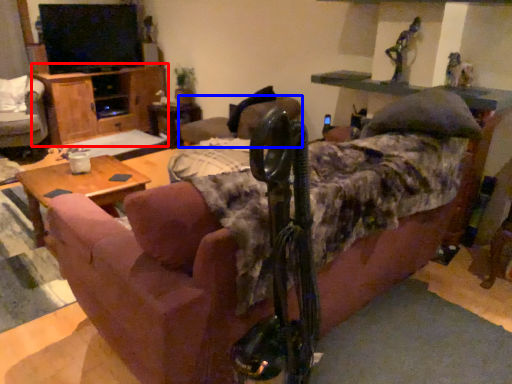
Question: Which object appears closest to the camera in this image, dresser (highlighted by a red box) or chair (highlighted by a blue box)?

Choices:
 (A) dresser
 (B) chair

Answer: (B)